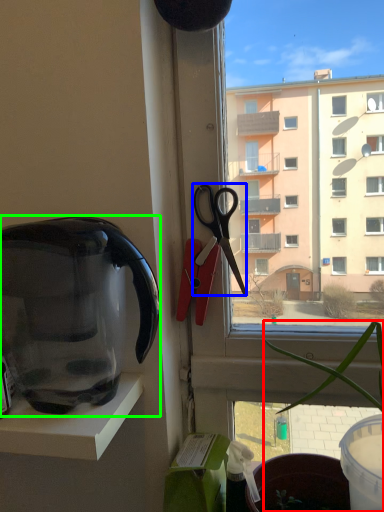
Question: Considering the real-world distances, which object is farthest from houseplant (highlighted by a red box)? scissors (highlighted by a blue box) or kettle (highlighted by a green box)?

Choices:
 (A) scissors
 (B) kettle

Answer: (B)